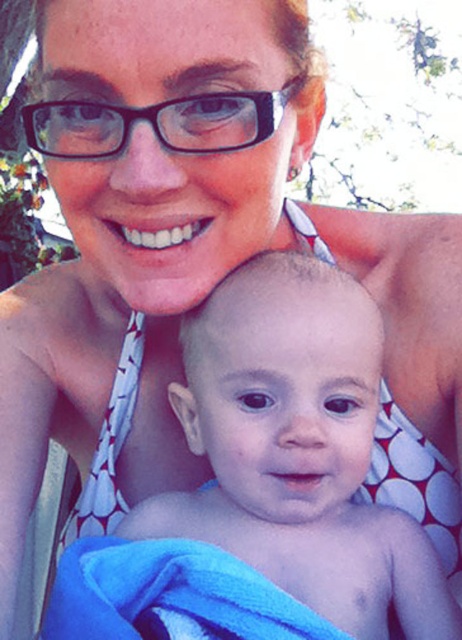
Question: Is smooth skin baby at center to the right of blue soft towel at lower left from the viewer's perspective?

Choices:
 (A) no
 (B) yes

Answer: (B)

Question: Which of these objects is positioned farthest from the smooth skin baby at center?

Choices:
 (A) black plastic glasses at upper center
 (B) white dotted fabric bikini top at center

Answer: (A)

Question: Among these objects, which one is farthest from the camera?

Choices:
 (A) black plastic glasses at upper center
 (B) blue soft towel at lower left
 (C) smooth skin baby at center
 (D) white dotted fabric bikini top at center

Answer: (D)

Question: Is smooth skin baby at center to the left of blue soft towel at lower left from the viewer's perspective?

Choices:
 (A) no
 (B) yes

Answer: (A)

Question: Is the position of black plastic glasses at upper center less distant than that of white dotted fabric bikini top at center?

Choices:
 (A) no
 (B) yes

Answer: (B)

Question: Among these objects, which one is farthest from the camera?

Choices:
 (A) blue soft towel at lower left
 (B) smooth skin baby at center
 (C) white dotted fabric bikini top at center
 (D) black plastic glasses at upper center

Answer: (C)